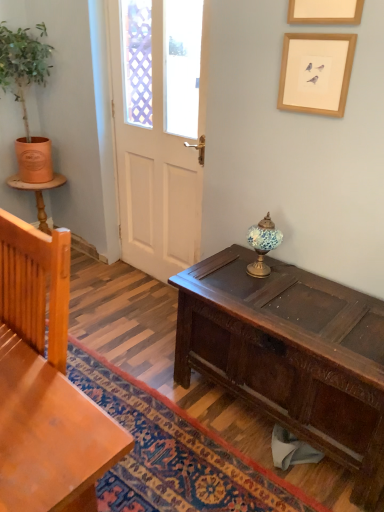
I want to click on vacant space to the left of dark brown wood desk at center, so [x=158, y=384].